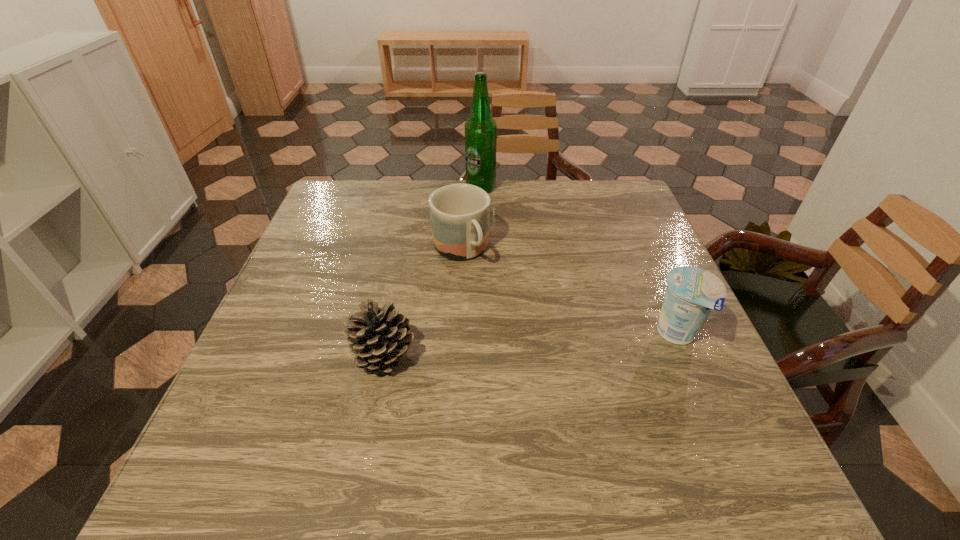
Identify the location of vacant space at the far right corner of the desktop. (588, 208).

The height and width of the screenshot is (540, 960). I want to click on free space between the farthest object and the yogurt, so click(579, 261).

What are the coordinates of `unoccupied area between the mug and the yogurt` in the screenshot? It's located at (569, 292).

I want to click on empty location between the pinecone and the beer bottle, so pos(432,271).

Locate an element on the screen. free area in between the tallest object and the pinecone is located at coordinates (432, 271).

What are the coordinates of `free point between the leftmost object and the yogurt` in the screenshot? It's located at (531, 345).

At what (x,y) coordinates should I click in order to perform the action: click on free space that is in between the leftmost object and the yogurt. Please return your answer as a coordinate pair (x, y). The height and width of the screenshot is (540, 960). Looking at the image, I should click on (531, 345).

In order to click on free spot between the mug and the yogurt in this screenshot , I will do `click(569, 292)`.

Where is `free space between the mug and the rightmost object`? free space between the mug and the rightmost object is located at coordinates (569, 292).

You are a GUI agent. You are given a task and a screenshot of the screen. Output one action in this format:
    pyautogui.click(x=<x>, y=<y>)
    Task: Click on the free space that is in between the leftmost object and the mug
    
    Given the screenshot: What is the action you would take?
    pyautogui.click(x=422, y=302)